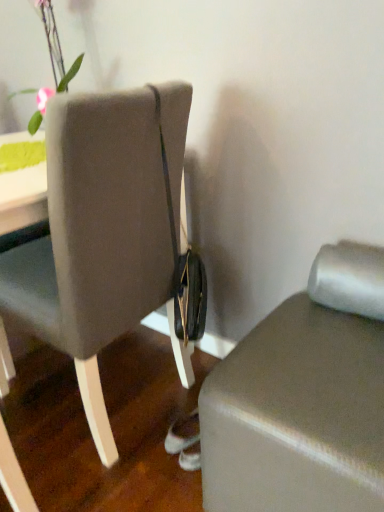
Question: Is matte gray ottoman at lower right far from matte gray chair at center?

Choices:
 (A) no
 (B) yes

Answer: (A)

Question: Is matte gray chair at center located within matte gray ottoman at lower right?

Choices:
 (A) no
 (B) yes

Answer: (A)

Question: Can you confirm if matte gray ottoman at lower right is smaller than matte gray chair at center?

Choices:
 (A) yes
 (B) no

Answer: (A)

Question: Would you say matte gray ottoman at lower right is outside matte gray chair at center?

Choices:
 (A) no
 (B) yes

Answer: (B)

Question: Is matte gray ottoman at lower right closer to camera compared to matte gray chair at center?

Choices:
 (A) yes
 (B) no

Answer: (A)

Question: From a real-world perspective, is matte gray chair at center above or below matte gray ottoman at lower right?

Choices:
 (A) below
 (B) above

Answer: (B)

Question: From the image's perspective, is matte gray chair at center above or below matte gray ottoman at lower right?

Choices:
 (A) below
 (B) above

Answer: (B)

Question: Considering the positions of matte gray chair at center and matte gray ottoman at lower right in the image, is matte gray chair at center wider or thinner than matte gray ottoman at lower right?

Choices:
 (A) thin
 (B) wide

Answer: (B)

Question: Is matte gray chair at center taller or shorter than matte gray ottoman at lower right?

Choices:
 (A) short
 (B) tall

Answer: (B)

Question: From the image's perspective, is matte gray chair at center positioned above or below green matte vase at upper left?

Choices:
 (A) below
 (B) above

Answer: (A)

Question: Is point (18, 253) positioned closer to the camera than point (49, 22)?

Choices:
 (A) farther
 (B) closer

Answer: (B)

Question: Is matte gray chair at center bigger or smaller than green matte vase at upper left?

Choices:
 (A) big
 (B) small

Answer: (A)

Question: Would you say matte gray chair at center is to the left or to the right of green matte vase at upper left in the picture?

Choices:
 (A) left
 (B) right

Answer: (B)

Question: Do you think matte gray ottoman at lower right is within green matte vase at upper left, or outside of it?

Choices:
 (A) outside
 (B) inside

Answer: (A)

Question: From a real-world perspective, relative to green matte vase at upper left, is matte gray ottoman at lower right vertically above or below?

Choices:
 (A) below
 (B) above

Answer: (A)